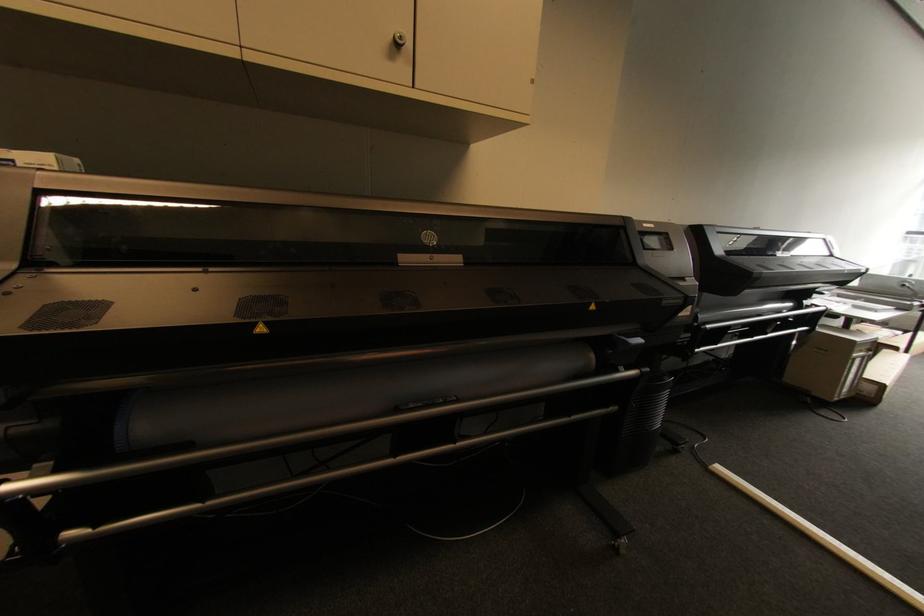
The width and height of the screenshot is (924, 616). Describe the element at coordinates (398, 39) in the screenshot. I see `a metal cabinet lock` at that location.